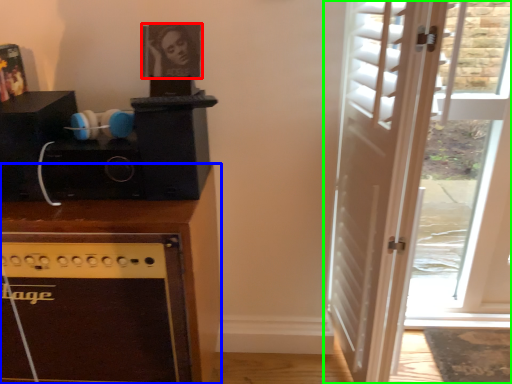
Question: Which is farther away from picture frame (highlighted by a red box)? cabinetry (highlighted by a blue box) or door (highlighted by a green box)?

Choices:
 (A) cabinetry
 (B) door

Answer: (B)